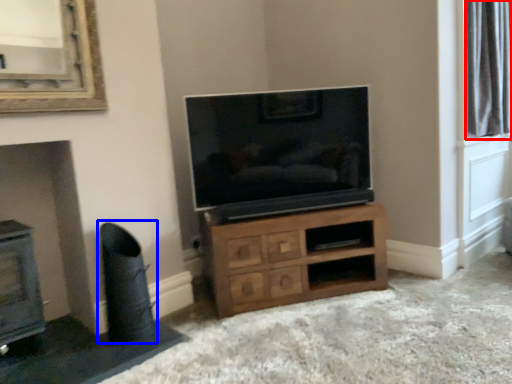
Question: Among these objects, which one is farthest to the camera, bay window (highlighted by a red box) or swivel chair (highlighted by a blue box)?

Choices:
 (A) bay window
 (B) swivel chair

Answer: (A)